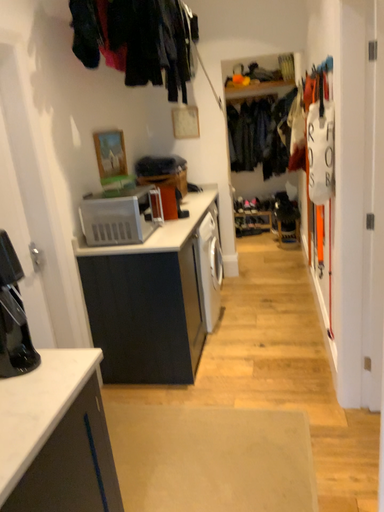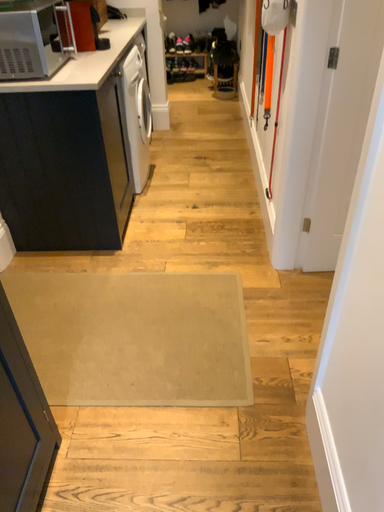
Question: Which way did the camera rotate in the video?

Choices:
 (A) rotated right
 (B) rotated left

Answer: (A)